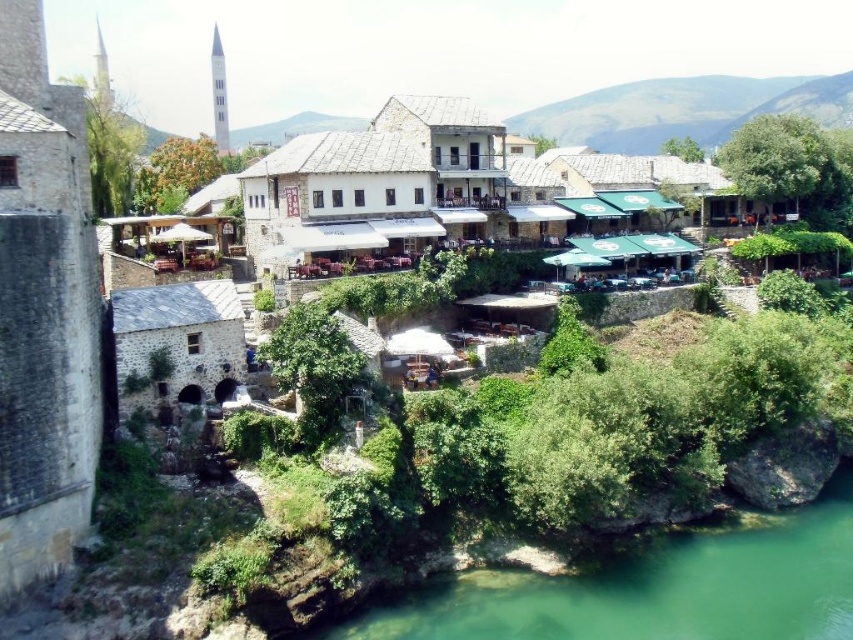
Is point (537, 611) farther from camera compared to point (491, 211)?

No, (537, 611) is closer to viewer.

Which is in front, point (788, 540) or point (392, 140)?

Point (788, 540) is in front.

The width and height of the screenshot is (853, 640). In order to click on green stone river at lower center in this screenshot , I will do `click(654, 588)`.